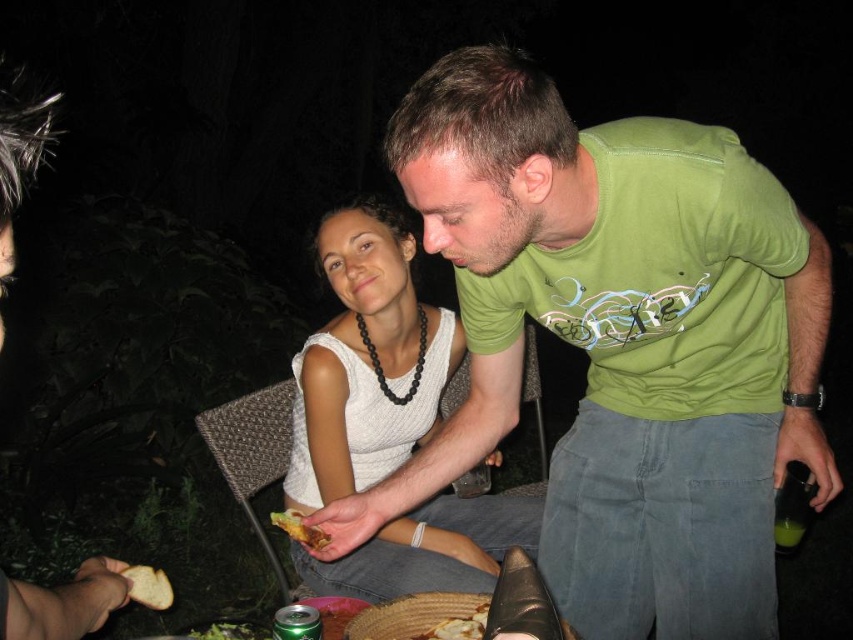
Based on the scene description, where is the green cotton shirt at center located in terms of its 2D coordinates?

The green cotton shirt at center is located at the 2D coordinates point (619, 342).